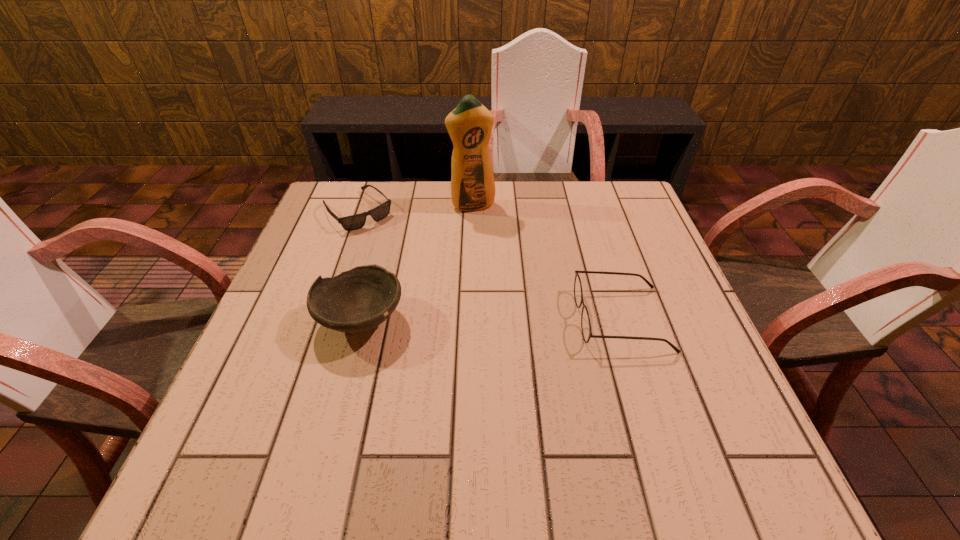
Locate an element on the screen. bowl is located at coordinates (355, 301).

Find the location of `spectacles`. spectacles is located at coordinates (578, 293).

Find the location of `the second shortest object`. the second shortest object is located at coordinates [x=578, y=293].

You are a GUI agent. You are given a task and a screenshot of the screen. Output one action in this format:
    pyautogui.click(x=<x>, y=<y>)
    Task: Click on the detergent
    This screenshot has width=960, height=540.
    Given the screenshot: What is the action you would take?
    pyautogui.click(x=469, y=125)

Locate an element on the screen. This screenshot has height=540, width=960. the tallest object is located at coordinates (469, 125).

You are a GUI agent. You are given a task and a screenshot of the screen. Output one action in this format:
    pyautogui.click(x=<x>, y=<y>)
    Task: Click on the shortest object
    This screenshot has width=960, height=540.
    Given the screenshot: What is the action you would take?
    (353, 222)

Where is `vacant space positioned on the back of the second tallest object`? vacant space positioned on the back of the second tallest object is located at coordinates (374, 269).

Locate an element on the screen. The height and width of the screenshot is (540, 960). free point located 0.260m on the front-facing side of the spectacles is located at coordinates (457, 319).

Find the location of `vacant space located 0.280m on the front-facing side of the spectacles`. vacant space located 0.280m on the front-facing side of the spectacles is located at coordinates (448, 319).

Locate an element on the screen. This screenshot has width=960, height=540. vacant space situated on the front-facing side of the spectacles is located at coordinates (457, 319).